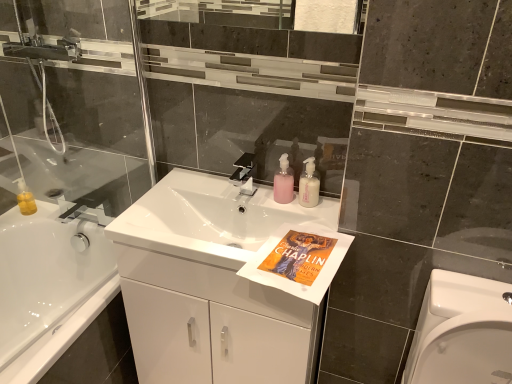
Where is `vacant space in front of pink matte soap dispenser at center, which ranks as the first toiletry in right-to-left order`? vacant space in front of pink matte soap dispenser at center, which ranks as the first toiletry in right-to-left order is located at coordinates (310, 230).